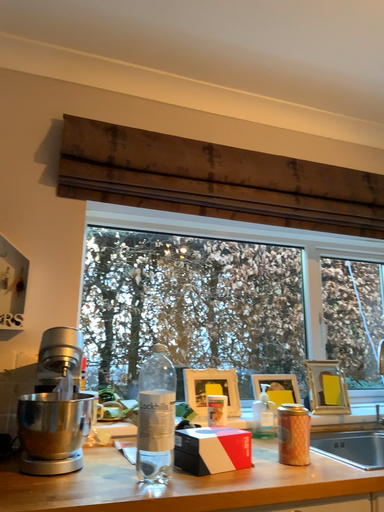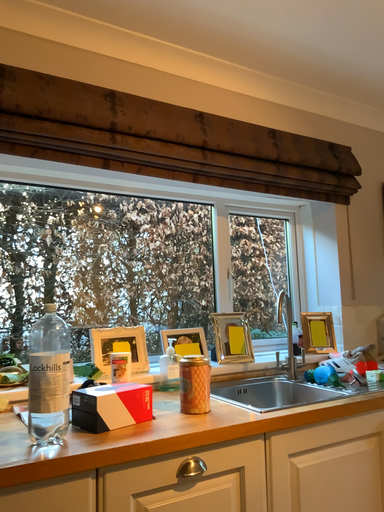
Question: How did the camera likely rotate when shooting the video?

Choices:
 (A) rotated left
 (B) rotated right

Answer: (B)